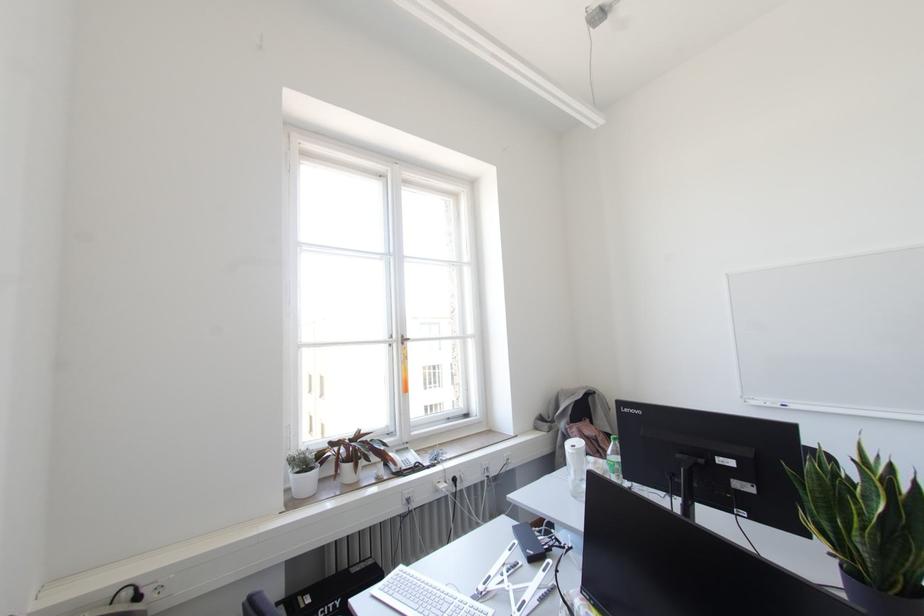
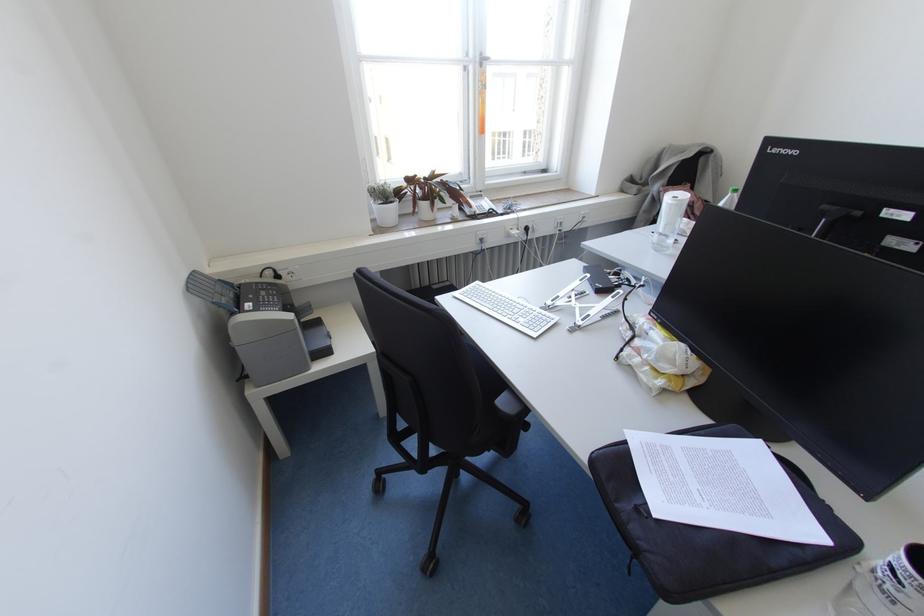
The point at (574,446) is marked in the first image. Where is the corresponding point in the second image?

(676, 197)